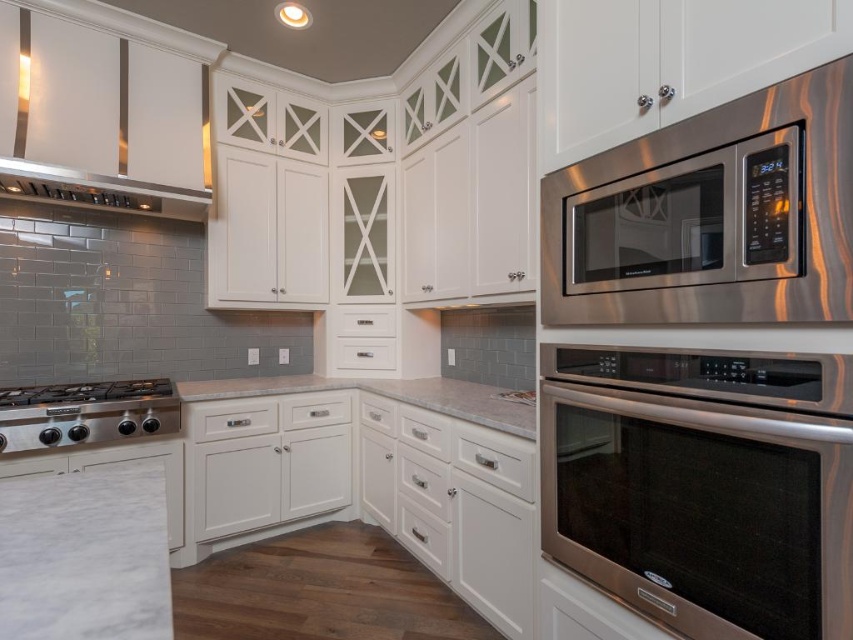
You are a kitchen designer planning to install a new appliance. You have a space that can only accommodate appliances up to 20 cm in thickness. You see the stainless steel microwave at upper right and the stainless steel gas stove at lower left in the kitchen. Which appliance can fit into the space?

The stainless steel microwave at upper right is thinner than the stainless steel gas stove at lower left, so it can fit into the 20 cm thickness space.

Looking at this image, you are standing in the kitchen and want to reach both the point at coordinates (641, 260) and the point at coordinates (160, 433). Which point will you need to stretch your arm further to reach?

You will need to stretch your arm further to reach the point at coordinates (160, 433) because it is farther from the camera compared to the point at (641, 260).